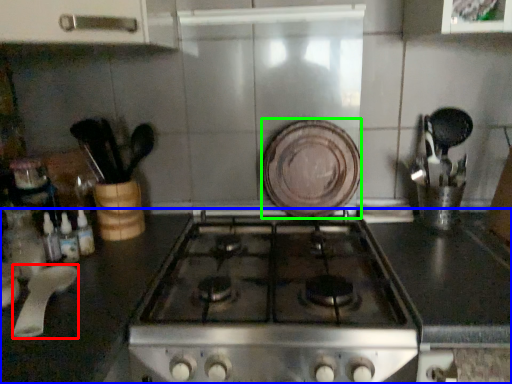
Question: Which object is the closest to the kitchen appliance (highlighted by a red box)? Choose among these: countertop (highlighted by a blue box) or plate (highlighted by a green box).

Choices:
 (A) countertop
 (B) plate

Answer: (A)